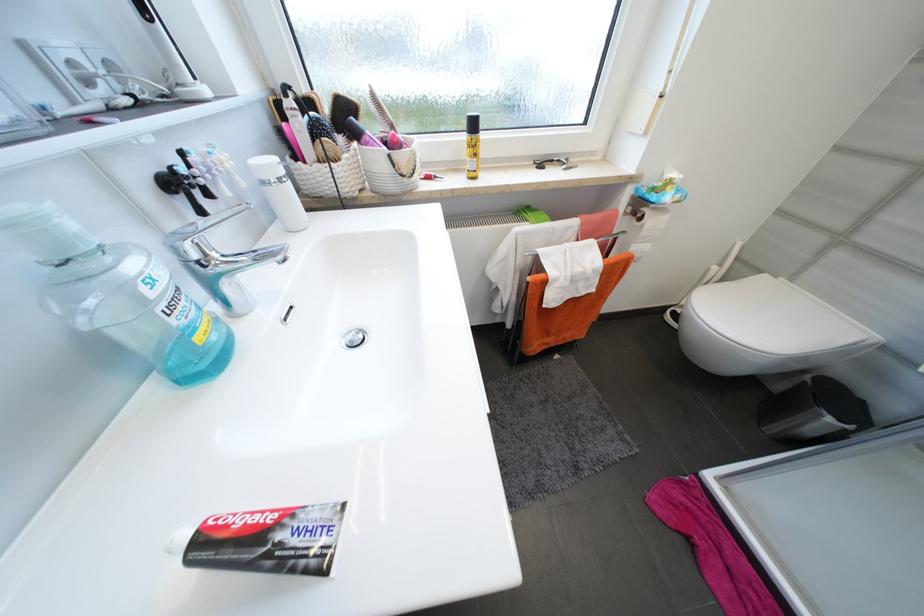
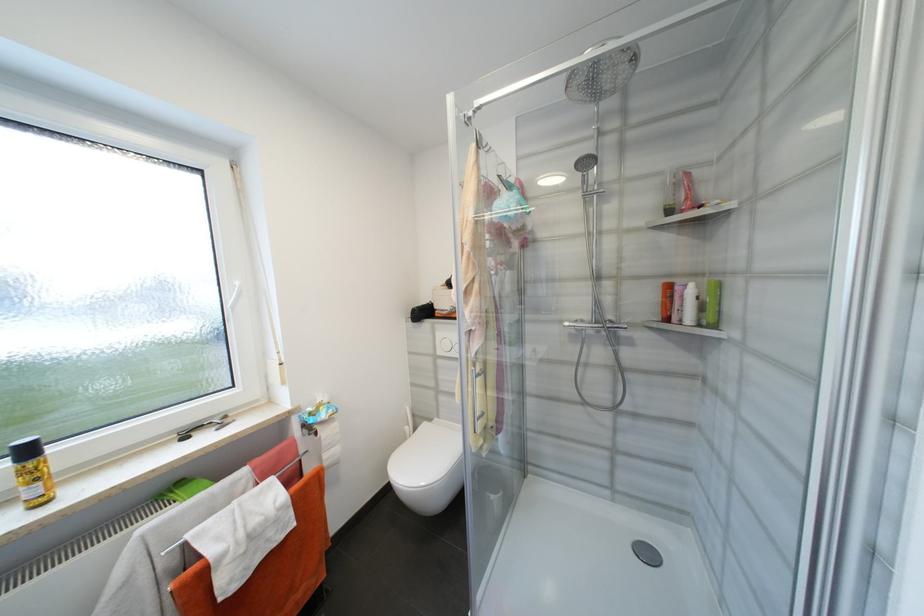
The point at (x=480, y=127) is marked in the first image. Where is the corresponding point in the second image?

(33, 453)